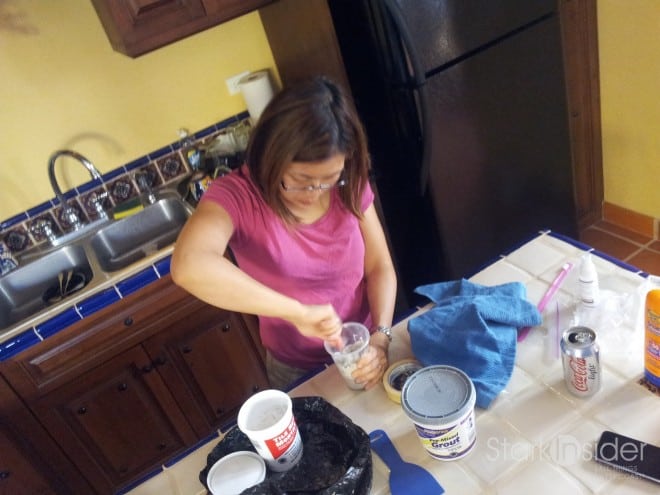
Find the location of a particular element. This screenshot has width=660, height=495. countertop is located at coordinates (525, 420), (523, 249), (171, 482), (363, 406).